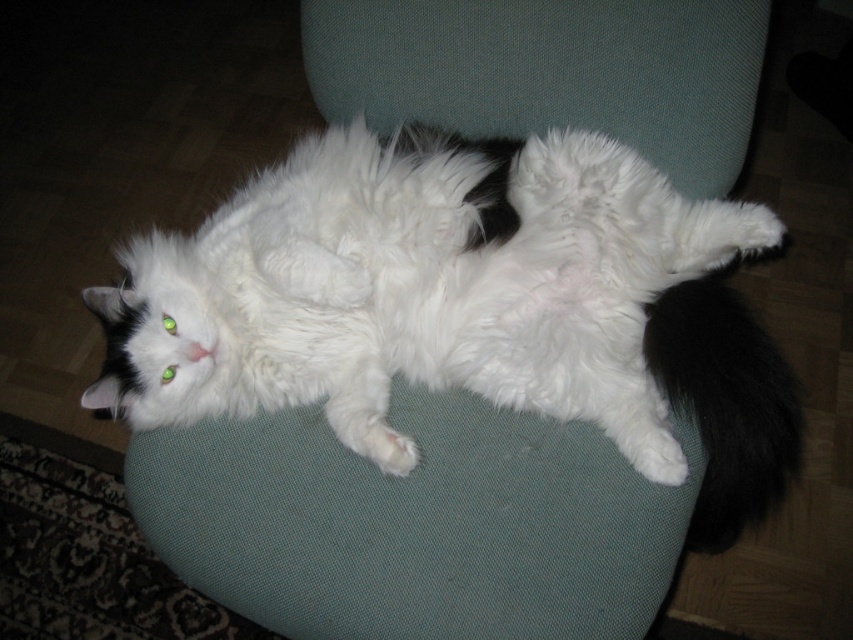
Question: Which object is positioned closest to the white fluffy cat at center?

Choices:
 (A) black fluffy tail at lower right
 (B) white fluffy cushion at center

Answer: (A)

Question: Which point is closer to the camera?

Choices:
 (A) white fluffy cushion at center
 (B) black fluffy tail at lower right

Answer: (B)

Question: Is white fluffy cat at center wider than black fluffy tail at lower right?

Choices:
 (A) no
 (B) yes

Answer: (B)

Question: Is white fluffy cat at center further to the viewer compared to white fluffy cushion at center?

Choices:
 (A) yes
 (B) no

Answer: (B)

Question: Does white fluffy cat at center appear on the right side of black fluffy tail at lower right?

Choices:
 (A) no
 (B) yes

Answer: (A)

Question: Which object appears farthest from the camera in this image?

Choices:
 (A) white fluffy cat at center
 (B) white fluffy cushion at center

Answer: (B)